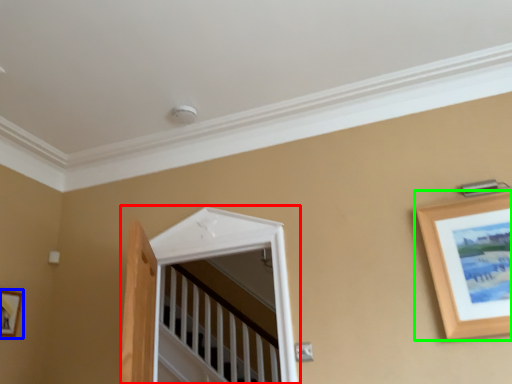
Question: Which object is positioned farthest from window (highlighted by a red box)? Select from picture frame (highlighted by a blue box) and picture frame (highlighted by a green box).

Choices:
 (A) picture frame
 (B) picture frame

Answer: (A)